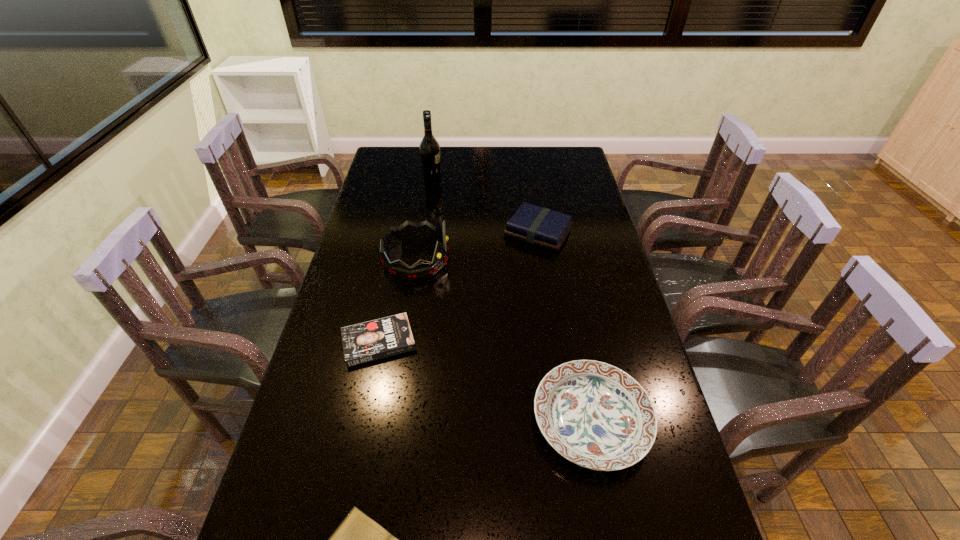
Locate which book ranks in proximity to the second nearest object. Please provide its 2D coordinates. Your answer should be formatted as a tuple, i.e. [(x, y)], where the tuple contains the x and y coordinates of a point satisfying the conditions above.

[(358, 539)]

Image resolution: width=960 pixels, height=540 pixels. Find the location of `vacant position in the image that satisfies the following two spatial constraints: 1. at the front of the second tallest object with jewels; 2. on the front side of the fifth tallest object`. vacant position in the image that satisfies the following two spatial constraints: 1. at the front of the second tallest object with jewels; 2. on the front side of the fifth tallest object is located at coordinates (403, 342).

Where is `vacant region that satisfies the following two spatial constraints: 1. at the front of the fifth farthest object with jewels; 2. on the right side of the second tallest object`? Image resolution: width=960 pixels, height=540 pixels. vacant region that satisfies the following two spatial constraints: 1. at the front of the fifth farthest object with jewels; 2. on the right side of the second tallest object is located at coordinates (391, 420).

This screenshot has width=960, height=540. What are the coordinates of `free space that satisfies the following two spatial constraints: 1. at the front of the second tallest object with jewels; 2. on the left side of the plate` in the screenshot? It's located at (391, 420).

Where is `vacant area that satisfies the following two spatial constraints: 1. on the back side of the rightmost book; 2. on the right side of the second shortest object`? Image resolution: width=960 pixels, height=540 pixels. vacant area that satisfies the following two spatial constraints: 1. on the back side of the rightmost book; 2. on the right side of the second shortest object is located at coordinates (401, 232).

Locate an element on the screen. This screenshot has width=960, height=540. free spot that satisfies the following two spatial constraints: 1. on the label of the wine bottle; 2. on the right side of the farthest book is located at coordinates (424, 232).